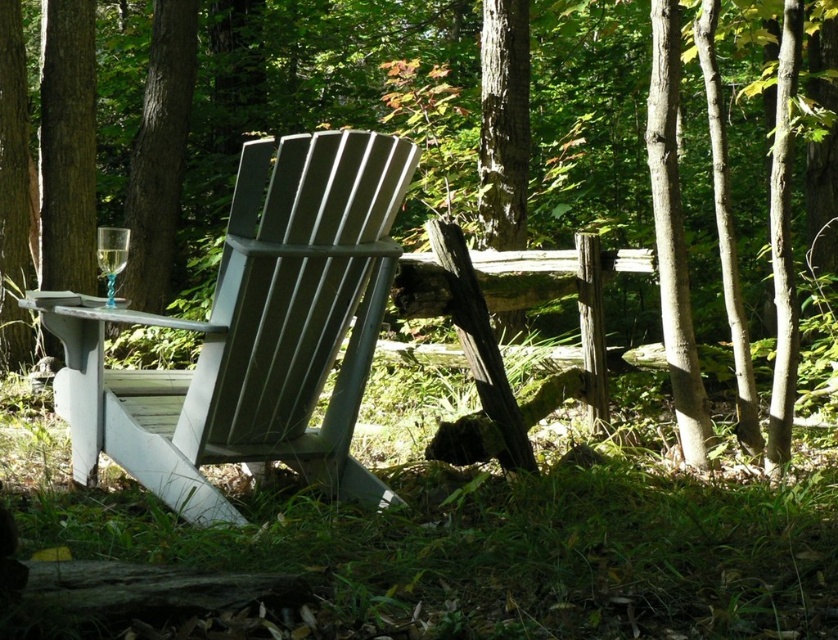
You are a painter setting up your easel in the forest scene. You want to paint the green textured tree trunk at upper left and the clear glass wine glass at left. Which object should you look at first if you are standing in front of the white Adirondack chair?

You should look at the clear glass wine glass at left first because the green textured tree trunk at upper left is located above it, meaning the wine glass is closer to your eye level when standing at the chair.

You are a painter standing 10 feet away from the clear glass wine glass at left. You want to paint the green textured tree trunk at upper left. Can you reach the tree trunk within your 15 feet painting range without moving?

The green textured tree trunk at upper left is 12.88 feet from the clear glass wine glass at left. Since you are 10 feet away from the clear glass wine glass at left, the total distance to the tree trunk would be 10 feet plus 12.88 feet, totaling 22.88 feet. This exceeds your 15 feet painting range, so you cannot reach the tree trunk without moving.